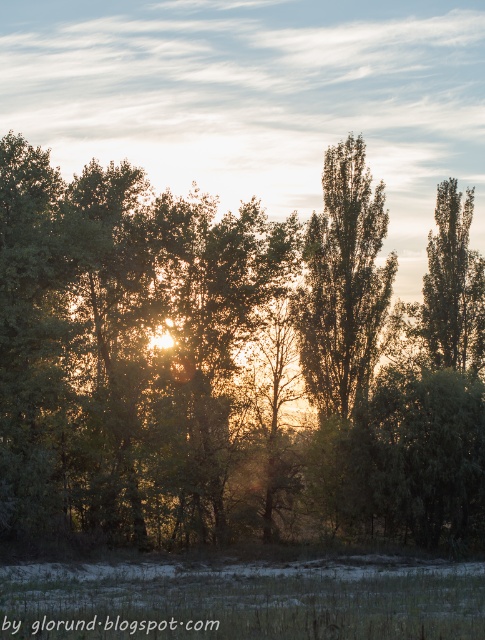
You are a bird looking for a nesting spot. You see the green leafy tree at center and the green leafy tree at upper right. Which tree would you choose if you prefer a taller nesting spot?

The green leafy tree at center has a greater height compared to the green leafy tree at upper right, so you should choose the green leafy tree at center for a taller nesting spot.

You are standing at the edge of a field and see the green grass at lower center and the green leafy tree at upper right. Which object is closer to you?

The green grass at lower center is closer to you because it is in front of the green leafy tree at upper right.

You are a hiker standing in the field and want to take a photo of the green leafy tree at center and the green leafy tree at upper right. Which tree should you move closer to in order to capture both trees in the frame without zooming in?

You should move closer to the green leafy tree at center because it is wider than the green leafy tree at upper right, allowing both to fit in the frame when positioned closer to the wider tree.